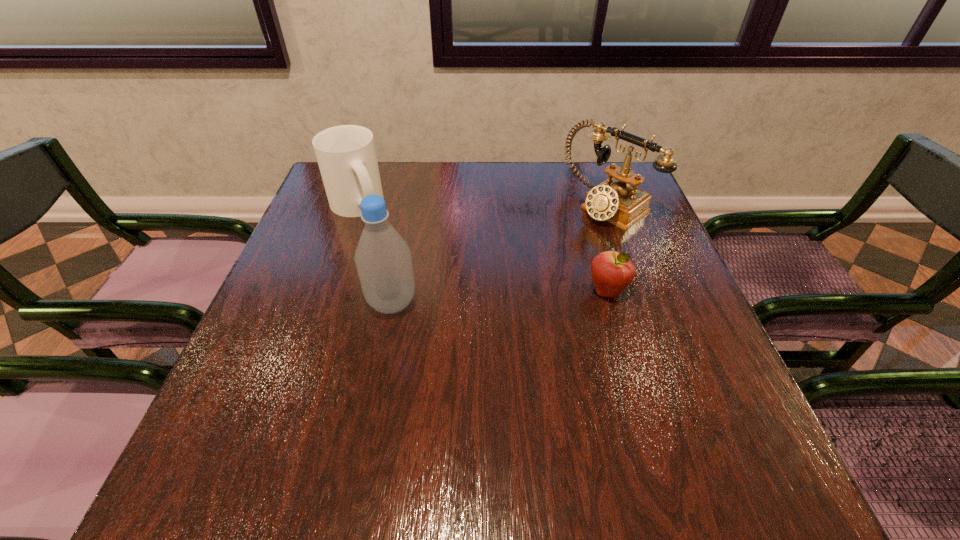
This screenshot has width=960, height=540. In order to click on object positioned at the far right corner in this screenshot , I will do click(614, 200).

Locate an element on the screen. This screenshot has width=960, height=540. vacant space at the far edge of the desktop is located at coordinates (510, 204).

At what (x,y) coordinates should I click in order to perform the action: click on vacant space at the near edge. Please return your answer as a coordinate pair (x, y). The image size is (960, 540). Looking at the image, I should click on (571, 420).

Identify the location of blank area at the left edge. The image size is (960, 540). (311, 217).

Locate an element on the screen. This screenshot has height=540, width=960. vacant space at the right edge of the desktop is located at coordinates (673, 341).

Find the location of `vacant space at the far right corner`. vacant space at the far right corner is located at coordinates (591, 176).

Where is `empty location between the shortest object and the tallest object`? This screenshot has width=960, height=540. empty location between the shortest object and the tallest object is located at coordinates (500, 297).

Find the location of `free space between the apple and the leftmost object`. free space between the apple and the leftmost object is located at coordinates (482, 248).

The height and width of the screenshot is (540, 960). Identify the location of free space between the second tallest object and the third tallest object. (481, 204).

The image size is (960, 540). In order to click on free space between the mug and the apple in this screenshot , I will do `click(482, 248)`.